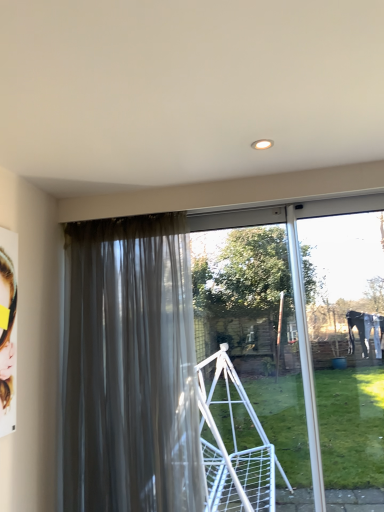
Where is `satin gray curtain at left`? This screenshot has height=512, width=384. satin gray curtain at left is located at coordinates [129, 368].

What is the approximate height of satin gray curtain at left?

It is 4.40 feet.

This screenshot has height=512, width=384. What do you see at coordinates (129, 368) in the screenshot?
I see `satin gray curtain at left` at bounding box center [129, 368].

Describe the element at coordinates (248, 350) in the screenshot. The image size is (384, 512). I see `clear glass screen door at center` at that location.

What are the coordinates of `clear glass screen door at center` in the screenshot? It's located at (248, 350).

Locate an element on the screen. The image size is (384, 512). satin gray curtain at left is located at coordinates (129, 368).

Can you confirm if clear glass screen door at center is positioned to the right of satin gray curtain at left?

Indeed, clear glass screen door at center is positioned on the right side of satin gray curtain at left.

Consider the image. Is clear glass screen door at center positioned behind satin gray curtain at left?

Yes, the depth of clear glass screen door at center is greater than that of satin gray curtain at left.

Which is behind, point (200, 227) or point (135, 227)?

The point (200, 227) is farther.

From the image's perspective, which is below, clear glass screen door at center or satin gray curtain at left?

satin gray curtain at left is shown below in the image.

From a real-world perspective, is clear glass screen door at center physically located above or below satin gray curtain at left?

clear glass screen door at center is below satin gray curtain at left.

Looking at their sizes, would you say clear glass screen door at center is wider or thinner than satin gray curtain at left?

Considering their sizes, clear glass screen door at center looks slimmer than satin gray curtain at left.

Between clear glass screen door at center and satin gray curtain at left, which one has less height?

With less height is clear glass screen door at center.

Looking at this image, can you confirm if clear glass screen door at center is smaller than satin gray curtain at left?

Indeed, clear glass screen door at center has a smaller size compared to satin gray curtain at left.

Is clear glass screen door at center completely or partially outside of satin gray curtain at left?

Absolutely, clear glass screen door at center is external to satin gray curtain at left.

Would you consider clear glass screen door at center to be distant from satin gray curtain at left?

Yes, clear glass screen door at center and satin gray curtain at left are quite far apart.

Is clear glass screen door at center facing towards satin gray curtain at left?

No, clear glass screen door at center is not oriented towards satin gray curtain at left.

The height and width of the screenshot is (512, 384). I want to click on screen door lying above the satin gray curtain at left (from the image's perspective), so tap(248, 350).

Does satin gray curtain at left appear on the left side of clear glass screen door at center?

Indeed, satin gray curtain at left is positioned on the left side of clear glass screen door at center.

Relative to clear glass screen door at center, is satin gray curtain at left in front or behind?

Visually, satin gray curtain at left is located in front of clear glass screen door at center.

Is point (87, 403) closer or farther from the camera than point (269, 452)?

Point (87, 403).

From the image's perspective, is satin gray curtain at left above clear glass screen door at center?

Incorrect, from the image's perspective, satin gray curtain at left is lower than clear glass screen door at center.

From a real-world perspective, is satin gray curtain at left positioned above or below clear glass screen door at center?

satin gray curtain at left is situated higher than clear glass screen door at center in the real world.

Considering the relative sizes of satin gray curtain at left and clear glass screen door at center in the image provided, is satin gray curtain at left wider than clear glass screen door at center?

Indeed, satin gray curtain at left has a greater width compared to clear glass screen door at center.

Considering the sizes of objects satin gray curtain at left and clear glass screen door at center in the image provided, who is taller, satin gray curtain at left or clear glass screen door at center?

With more height is satin gray curtain at left.

Does satin gray curtain at left have a larger size compared to clear glass screen door at center?

Yes.

Is satin gray curtain at left not within clear glass screen door at center?

Yes.

Is satin gray curtain at left not close to clear glass screen door at center?

Yes.

Is satin gray curtain at left turned away from clear glass screen door at center?

No, satin gray curtain at left is not facing the opposite direction of clear glass screen door at center.

What's the angular difference between satin gray curtain at left and clear glass screen door at center's facing directions?

4.31 degrees separate the facing orientations of satin gray curtain at left and clear glass screen door at center.

Where is `curtain located on the left of clear glass screen door at center`? curtain located on the left of clear glass screen door at center is located at coordinates point(129,368).

Where is `screen door to the right of satin gray curtain at left`? screen door to the right of satin gray curtain at left is located at coordinates (248, 350).

The width and height of the screenshot is (384, 512). Find the location of `curtain that appears below the clear glass screen door at center (from the image's perspective)`. curtain that appears below the clear glass screen door at center (from the image's perspective) is located at coordinates (129, 368).